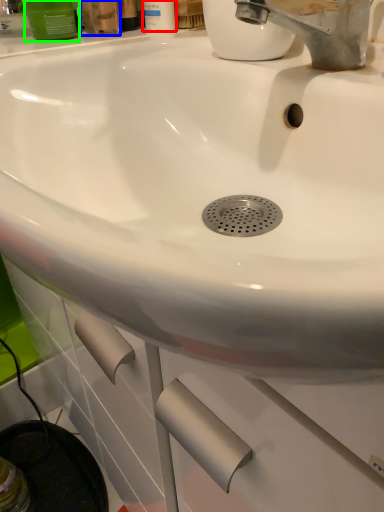
Question: Estimate the real-world distances between objects in this image. Which object is closer to mouthwash (highlighted by a red box), mouthwash (highlighted by a blue box) or mouthwash (highlighted by a green box)?

Choices:
 (A) mouthwash
 (B) mouthwash

Answer: (A)